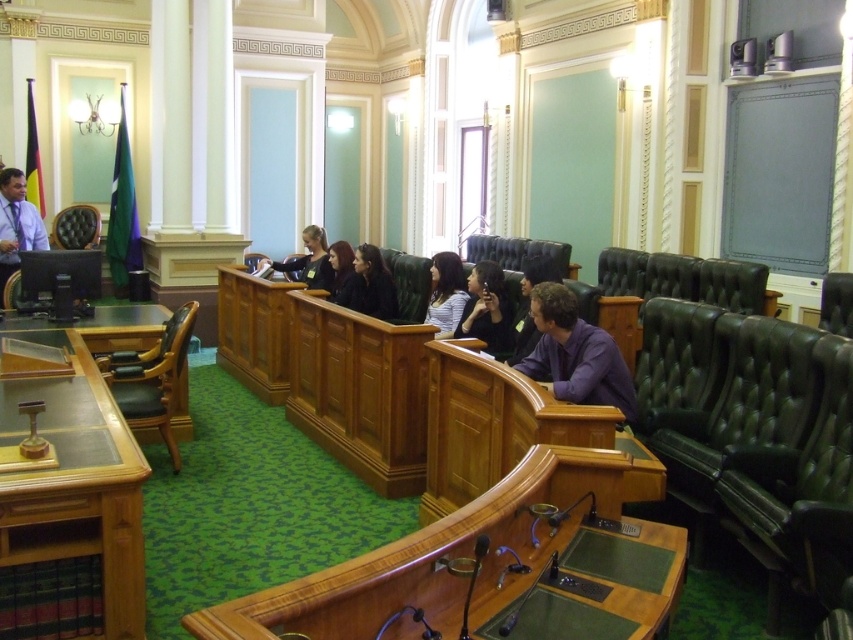
Question: Is matte black laptop at center above leather tufted chair at left?

Choices:
 (A) yes
 (B) no

Answer: (B)

Question: Which point is closer to the camera taking this photo?

Choices:
 (A) (840, 298)
 (B) (474, 272)
 (C) (123, 410)
 (D) (305, 237)

Answer: (C)

Question: Is brown leather chair at left wider than matte black laptop at center?

Choices:
 (A) yes
 (B) no

Answer: (B)

Question: From the image, what is the correct spatial relationship of matte black shirt at left in relation to purple matte jacket at center?

Choices:
 (A) right
 (B) left

Answer: (B)

Question: Among these objects, which one is nearest to the camera?

Choices:
 (A) matte black shirt at left
 (B) matte black jacket at center

Answer: (B)

Question: Among these points, which one is nearest to the camera?

Choices:
 (A) (426, 291)
 (B) (12, 208)

Answer: (A)